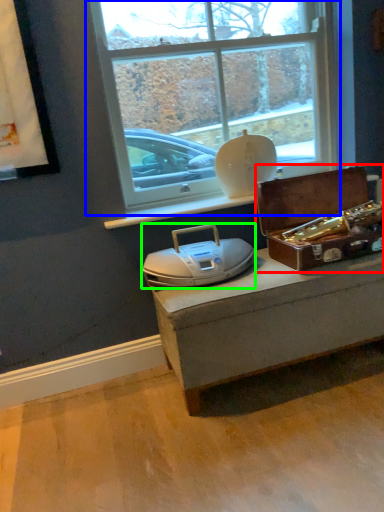
Question: Which is farther away from box (highlighted by a red box)? window (highlighted by a blue box) or stereo (highlighted by a green box)?

Choices:
 (A) window
 (B) stereo

Answer: (A)